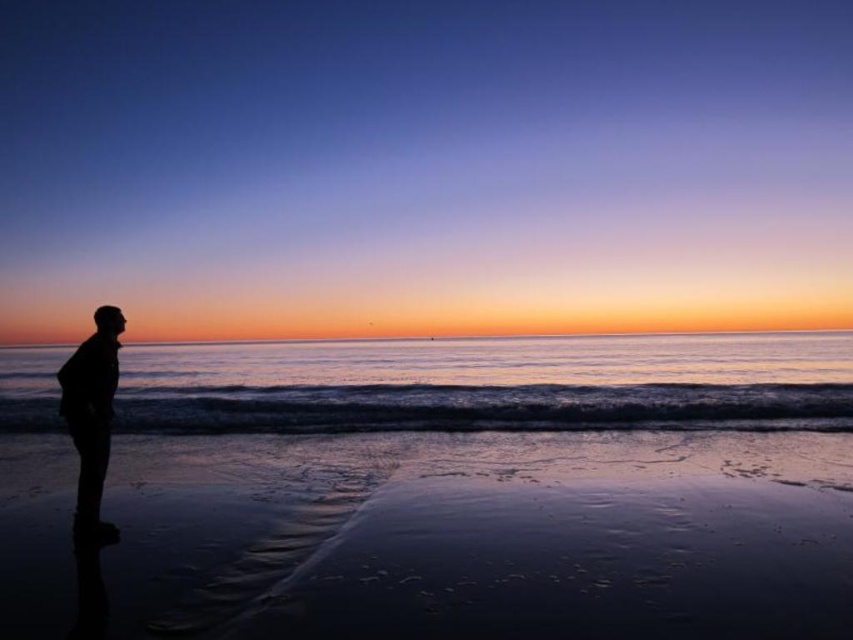
Is shiny wet sand at lower center bigger than silhouette figure at left?

Yes.

Between point (288, 504) and point (88, 516), which one is positioned behind?

The point (288, 504) is behind.

Who is more distant from viewer, [577,554] or [100,317]?

Point [100,317]

The image size is (853, 640). I want to click on shiny wet sand at lower center, so coord(439,538).